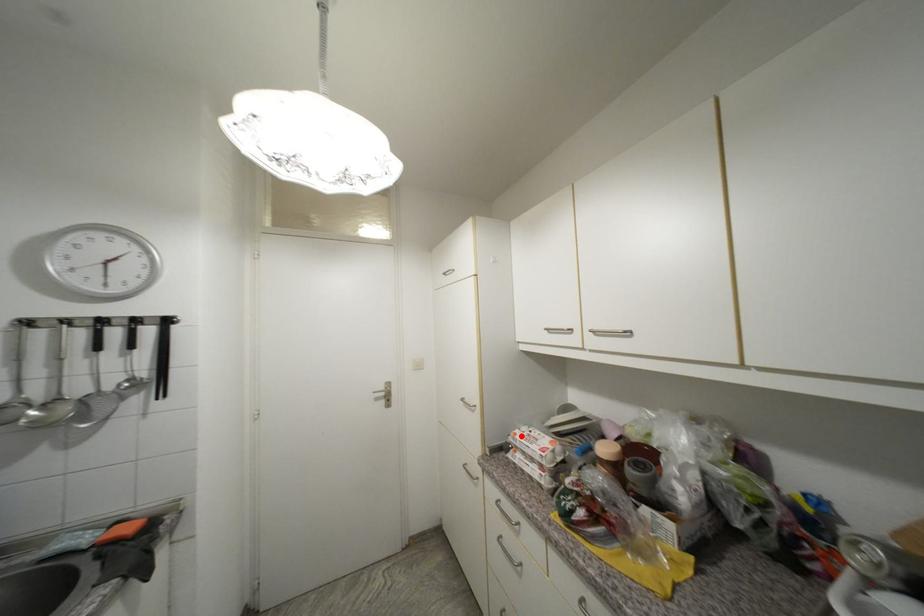
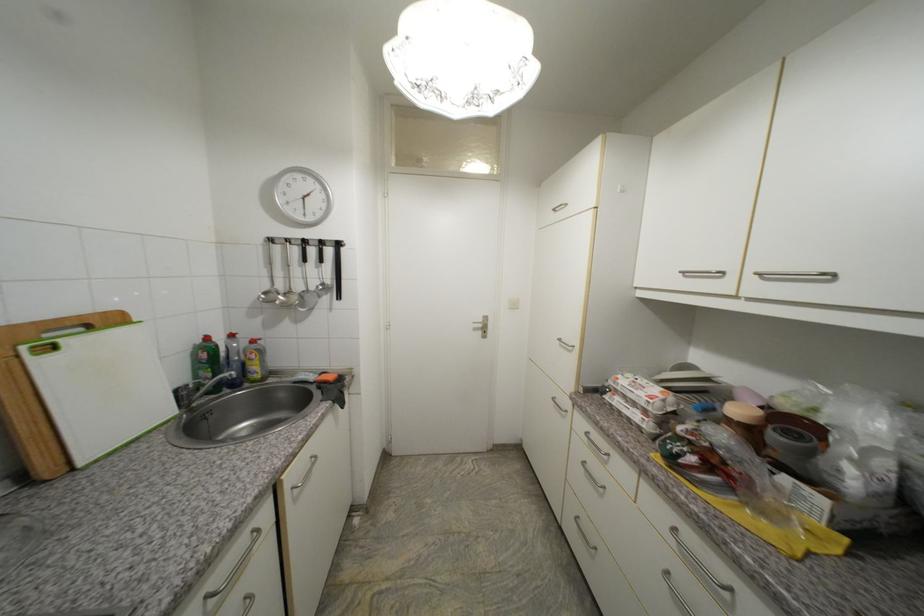
Question: I am providing you with two images of the same scene from different viewpoints. A red point is marked on the first image. At the location where the point appears in image 1, is it still visible in image 2?

Choices:
 (A) Yes
 (B) No

Answer: (A)